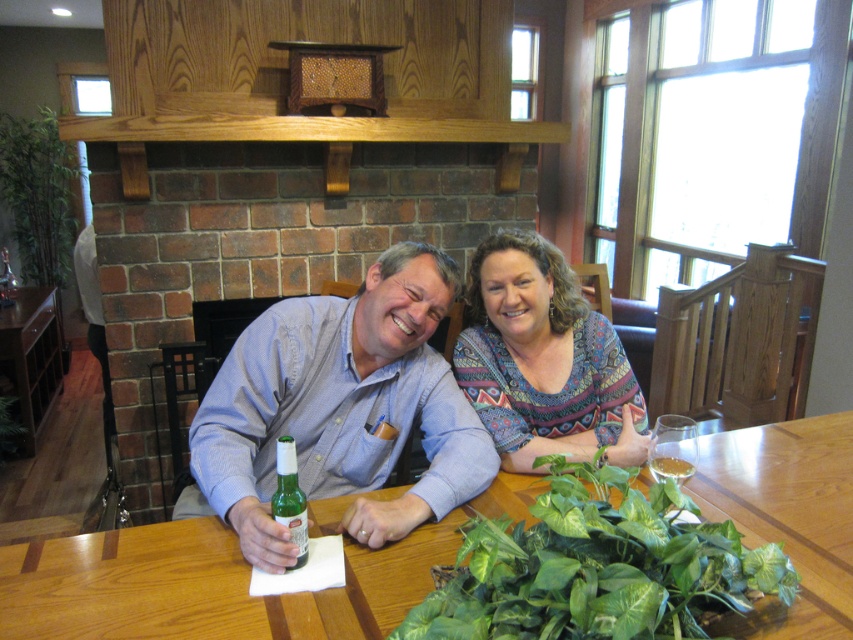
Can you confirm if matte blue shirt at center is taller than clear glass wine glass at right?

Yes.

Does matte blue shirt at center come behind clear glass wine glass at right?

Yes, it is behind clear glass wine glass at right.

What do you see at coordinates (339, 410) in the screenshot?
I see `matte blue shirt at center` at bounding box center [339, 410].

Locate an element on the screen. matte blue shirt at center is located at coordinates [339, 410].

Measure the distance between point (393, 554) and camera.

The distance of point (393, 554) from camera is 3.97 feet.

Identify the location of wooden table at center. (204, 586).

The image size is (853, 640). Identify the location of wooden table at center. (204, 586).

Between brick fireplace at center and matte blue shirt at center, which one has less height?

Standing shorter between the two is matte blue shirt at center.

Does point (299, 227) come closer to viewer compared to point (378, 365)?

No, (299, 227) is behind (378, 365).

You are a GUI agent. You are given a task and a screenshot of the screen. Output one action in this format:
    pyautogui.click(x=<x>, y=<y>)
    Task: Click on the brick fireplace at center
    
    Given the screenshot: What is the action you would take?
    pyautogui.click(x=264, y=243)